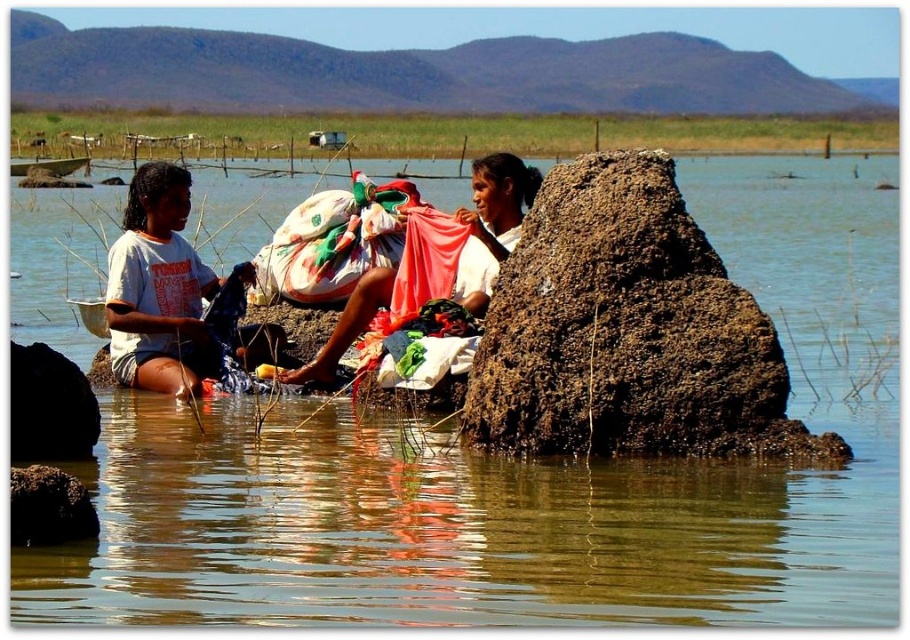
Question: Is brown mud rock at right positioned before white cotton shirt at left?

Choices:
 (A) yes
 (B) no

Answer: (A)

Question: From the image, what is the correct spatial relationship of clear water at center in relation to brown mud rock at lower left?

Choices:
 (A) below
 (B) above

Answer: (B)

Question: Which point is farther to the camera?

Choices:
 (A) (486, 296)
 (B) (671, 365)
 (C) (37, 509)
 (D) (862, 611)

Answer: (A)

Question: From the image, what is the correct spatial relationship of clear water at center in relation to brown mud rock at lower left?

Choices:
 (A) above
 (B) below

Answer: (A)

Question: Which point is farther to the camera?

Choices:
 (A) (464, 301)
 (B) (130, 205)
 (C) (21, 417)

Answer: (B)

Question: Which point appears farthest from the camera in this image?

Choices:
 (A) (329, 355)
 (B) (86, 390)
 (C) (504, 538)
 (D) (198, 282)

Answer: (D)